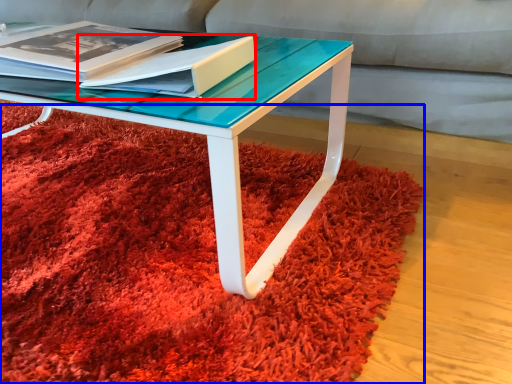
Question: Which point is closer to the camera, paperback book (highlighted by a red box) or mat (highlighted by a blue box)?

Choices:
 (A) paperback book
 (B) mat

Answer: (B)